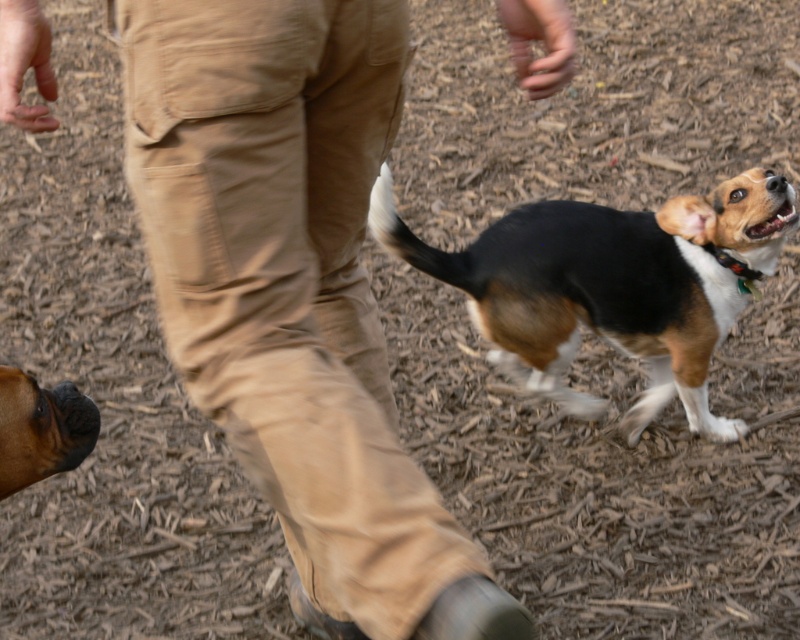
Is tan/cotton pants at center shorter than black and tan fur dog at center?

No, tan/cotton pants at center is not shorter than black and tan fur dog at center.

Is tan/cotton pants at center thinner than black and tan fur dog at center?

Indeed, tan/cotton pants at center has a lesser width compared to black and tan fur dog at center.

Locate an element on the screen. This screenshot has height=640, width=800. tan/cotton pants at center is located at coordinates (294, 292).

The height and width of the screenshot is (640, 800). I want to click on tan/cotton pants at center, so click(x=294, y=292).

Does tan/cotton pants at center have a larger size compared to brown glossy dog at lower left?

Yes, tan/cotton pants at center is bigger than brown glossy dog at lower left.

Can you confirm if tan/cotton pants at center is positioned to the right of brown glossy dog at lower left?

Yes, tan/cotton pants at center is to the right of brown glossy dog at lower left.

You are a GUI agent. You are given a task and a screenshot of the screen. Output one action in this format:
    pyautogui.click(x=<x>, y=<y>)
    Task: Click on the tan/cotton pants at center
    The height and width of the screenshot is (640, 800).
    Given the screenshot: What is the action you would take?
    pyautogui.click(x=294, y=292)

Can you confirm if black and tan fur dog at center is bigger than brown glossy dog at lower left?

Correct, black and tan fur dog at center is larger in size than brown glossy dog at lower left.

Is black and tan fur dog at center smaller than brown glossy dog at lower left?

No, black and tan fur dog at center is not smaller than brown glossy dog at lower left.

Is point (650, 275) less distant than point (28, 380)?

That is False.

You are a GUI agent. You are given a task and a screenshot of the screen. Output one action in this format:
    pyautogui.click(x=<x>, y=<y>)
    Task: Click on the black and tan fur dog at center
    This screenshot has width=800, height=640.
    Given the screenshot: What is the action you would take?
    pyautogui.click(x=610, y=285)